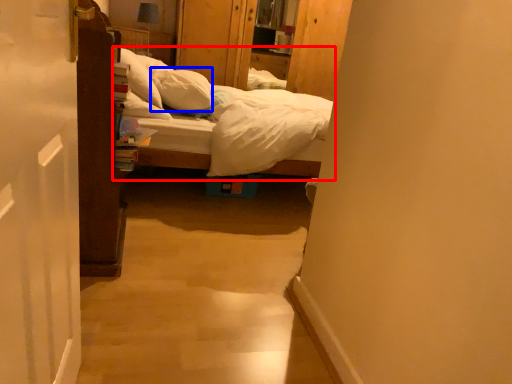
Question: Which of the following is the farthest to the observer, bed (highlighted by a red box) or pillow (highlighted by a blue box)?

Choices:
 (A) bed
 (B) pillow

Answer: (B)